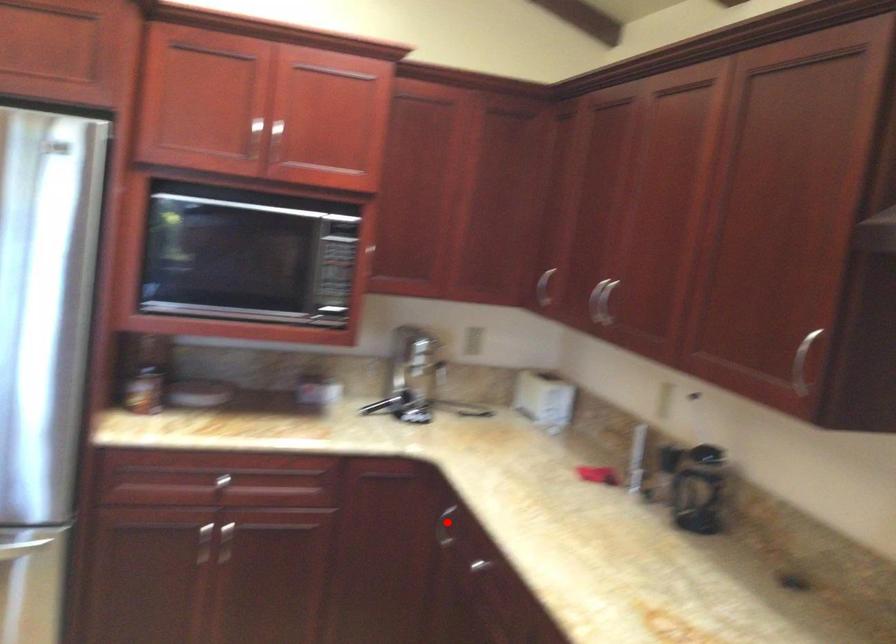
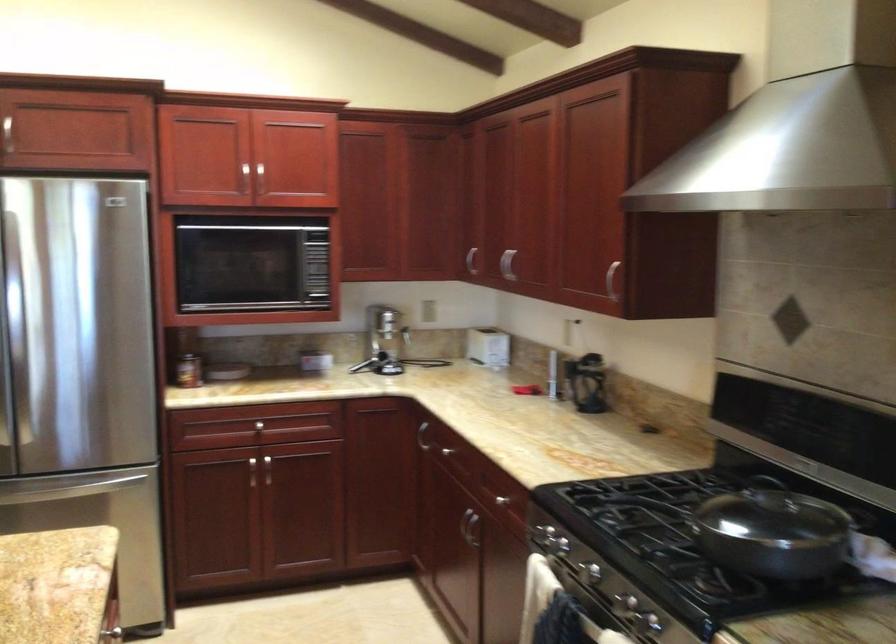
Find the pixel in the second image that matches the highlighted location in the first image.

(421, 436)